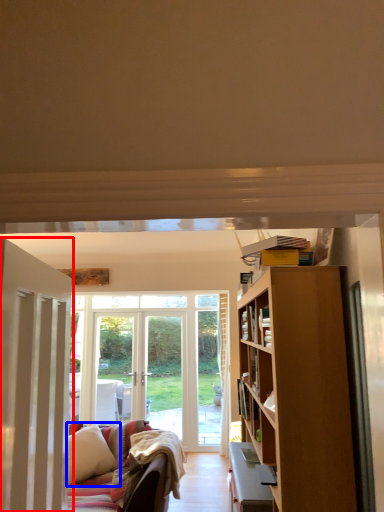
Question: Which of the following is the closest to the observer, door (highlighted by a red box) or pillow (highlighted by a blue box)?

Choices:
 (A) door
 (B) pillow

Answer: (A)